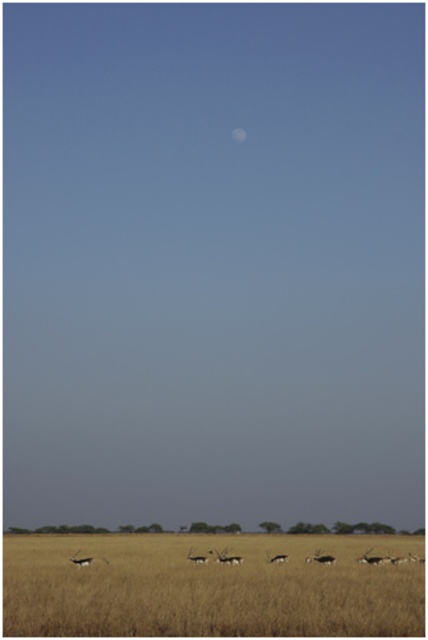
This screenshot has height=640, width=428. What do you see at coordinates (350, 529) in the screenshot?
I see `brown grassland at lower center` at bounding box center [350, 529].

Which is above, brown grassland at lower center or white glossy antelope at center?

Positioned higher is white glossy antelope at center.

Does point (262, 525) come in front of point (275, 557)?

No.

Where is `brown grassland at lower center`? brown grassland at lower center is located at coordinates (350, 529).

Is brown textured antelope at center closer to camera compared to white glossy antelope at center?

Yes, brown textured antelope at center is in front of white glossy antelope at center.

Where is `brown textured antelope at center`? The width and height of the screenshot is (428, 640). brown textured antelope at center is located at coordinates tap(196, 557).

Find the location of a particular element. This screenshot has width=428, height=640. brown textured antelope at center is located at coordinates (196, 557).

Between brown grassland at lower center and white matte moon at upper center, which one appears on the left side from the viewer's perspective?

Positioned to the left is brown grassland at lower center.

Is brown grassland at lower center above white matte moon at upper center?

No, brown grassland at lower center is not above white matte moon at upper center.

Find the location of a particular element. Image resolution: width=428 pixels, height=640 pixels. brown grassland at lower center is located at coordinates (350, 529).

Find the location of `brown grassland at lower center`. brown grassland at lower center is located at coordinates (350, 529).